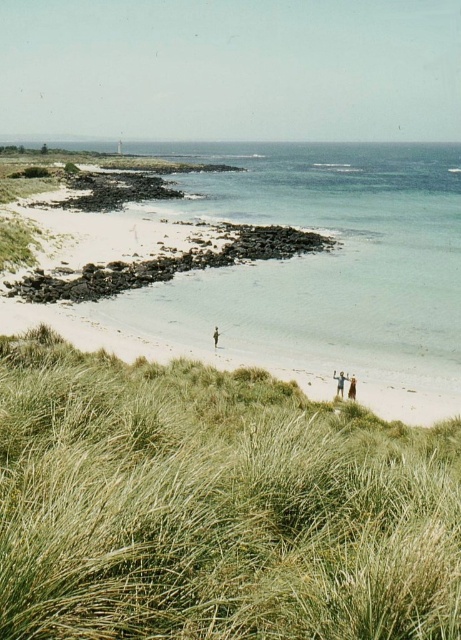
Question: Can you confirm if light brown wooden stick at lower right is wider than light brown hair at lower right?

Choices:
 (A) yes
 (B) no

Answer: (A)

Question: In this image, where is green grassy at lower left located relative to brown textured fabric at lower center?

Choices:
 (A) above
 (B) below

Answer: (A)

Question: Which point is farther to the camera?

Choices:
 (A) light brown wooden stick at lower right
 (B) green grassy at lower left
 (C) brown textured fabric at lower center

Answer: (A)

Question: Which object is the farthest from the green grassy at lower left?

Choices:
 (A) brown textured fabric at lower center
 (B) light brown wooden stick at lower right
 (C) light brown hair at lower right

Answer: (B)

Question: Based on their relative distances, which object is farther from the light brown wooden stick at lower right?

Choices:
 (A) brown textured fabric at lower center
 (B) light brown hair at lower right

Answer: (B)

Question: From the image, what is the correct spatial relationship of green grassy at lower left in relation to brown textured fabric at lower center?

Choices:
 (A) above
 (B) below

Answer: (A)